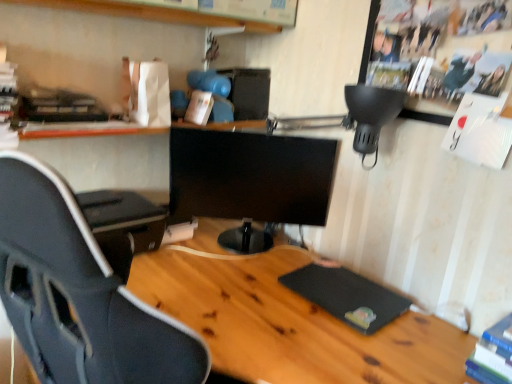
Find the location of a particular element. This screenshot has width=512, height=384. vacant area situated to the left side of black rubber mousepad at lower right is located at coordinates (254, 290).